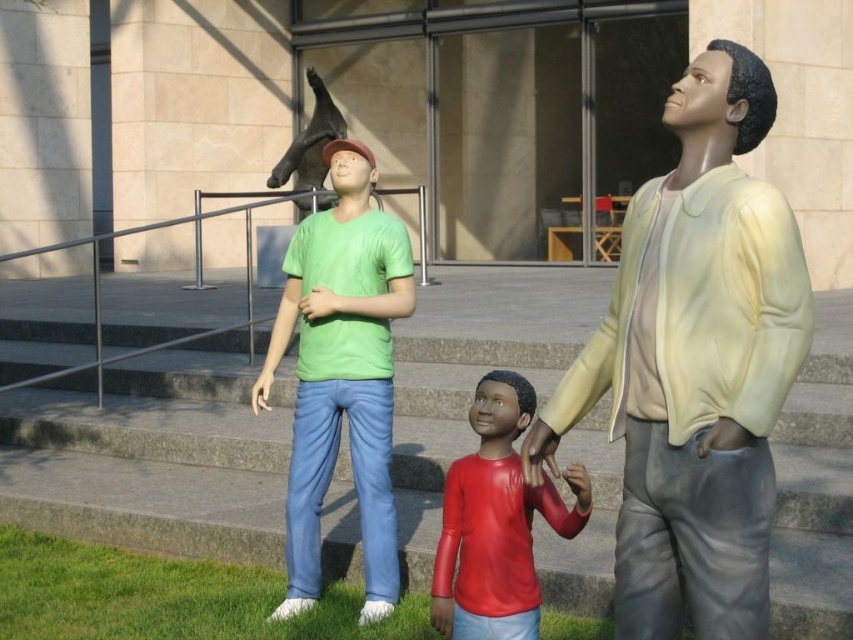
You are a photographer trying to capture a clear photo of the matte yellow jacket at center without the gray concrete stairs at center blocking it. Where should you position yourself relative to the statues to achieve this?

To capture the matte yellow jacket at center without the gray concrete stairs at center blocking it, position yourself behind the matte yellow jacket at center so that it is in front of the stairs.

Consider the image. You are standing in front of the statues and want to take a photo. The camera can only focus on objects closer than a certain distance. If you want to ensure both point [480,442] and point [531,456] are in focus, which point should you focus on?

You should focus on point [480,442] because it is closer to the camera than point [531,456]. This way, both points will be within the camera focus range.